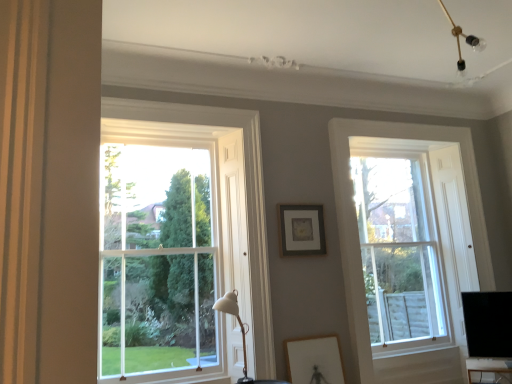
What is the approximate height of matte black picture frame at center, marked as the second picture frame in a front-to-back arrangement?

The height of matte black picture frame at center, marked as the second picture frame in a front-to-back arrangement, is 19.68 inches.

Locate an element on the screen. The width and height of the screenshot is (512, 384). clear glass window at right, the first window positioned from the back is located at coordinates (355, 217).

This screenshot has width=512, height=384. In order to click on clear glass window at left, which appears as the first window when viewed from the left in this screenshot , I will do `click(179, 241)`.

What is the approximate width of wooden framed picture at lower center, which is the 2th picture frame from top to bottom?

It is 2.80 inches.

At what (x,y) coordinates should I click in order to perform the action: click on white matte table lamp at center. Please return your answer as a coordinate pair (x, y). The width and height of the screenshot is (512, 384). Looking at the image, I should click on (239, 325).

This screenshot has height=384, width=512. What do you see at coordinates (488, 324) in the screenshot?
I see `black glossy monitor at lower right` at bounding box center [488, 324].

Find the location of a particular element. matte black picture frame at center, the first picture frame in the top-to-bottom sequence is located at coordinates (301, 230).

Is matte black picture frame at center, which is the second picture frame in bottom-to-top order, positioned beyond the bounds of clear glass window at right, the first window positioned from the back?

Yes, matte black picture frame at center, which is the second picture frame in bottom-to-top order, is not within clear glass window at right, the first window positioned from the back.

Is matte black picture frame at center, the first picture frame positioned from the back, positioned far away from clear glass window at right, which is the 2th window in front-to-back order?

matte black picture frame at center, the first picture frame positioned from the back, is actually quite close to clear glass window at right, which is the 2th window in front-to-back order.

How much distance is there between matte black picture frame at center, which is the second picture frame in bottom-to-top order, and clear glass window at right, which is the 2th window in front-to-back order?

25.44 inches.

Which object is positioned more to the right, matte black picture frame at center, which is the second picture frame in bottom-to-top order, or wooden framed picture at lower center, the 1th picture frame when ordered from front to back?

From the viewer's perspective, wooden framed picture at lower center, the 1th picture frame when ordered from front to back, appears more on the right side.

Looking at this image, from a real-world perspective, is matte black picture frame at center, the first picture frame positioned from the back, beneath wooden framed picture at lower center, arranged as the 1th picture frame when ordered from the bottom?

No, from a real-world perspective, matte black picture frame at center, the first picture frame positioned from the back, is not beneath wooden framed picture at lower center, arranged as the 1th picture frame when ordered from the bottom.

Can you confirm if matte black picture frame at center, marked as the second picture frame in a front-to-back arrangement, is wider than wooden framed picture at lower center, the 1th picture frame when ordered from front to back?

In fact, matte black picture frame at center, marked as the second picture frame in a front-to-back arrangement, might be narrower than wooden framed picture at lower center, the 1th picture frame when ordered from front to back.

Which of these two, matte black picture frame at center, the first picture frame positioned from the back, or wooden framed picture at lower center, which is the 2th picture frame from top to bottom, is smaller?

Smaller between the two is matte black picture frame at center, the first picture frame positioned from the back.

Where is `computer monitor that appears below the clear glass window at right, which is counted as the 2th window, starting from the left (from the image's perspective)`? The width and height of the screenshot is (512, 384). computer monitor that appears below the clear glass window at right, which is counted as the 2th window, starting from the left (from the image's perspective) is located at coordinates (488, 324).

Considering the sizes of objects clear glass window at right, which is counted as the 2th window, starting from the left, and black glossy monitor at lower right in the image provided, who is smaller, clear glass window at right, which is counted as the 2th window, starting from the left, or black glossy monitor at lower right?

With smaller size is black glossy monitor at lower right.

Measure the distance from clear glass window at right, the first window positioned from the back, to black glossy monitor at lower right.

A distance of 36.78 inches exists between clear glass window at right, the first window positioned from the back, and black glossy monitor at lower right.

Can you confirm if clear glass window at right, which is the 2th window in front-to-back order, is shorter than black glossy monitor at lower right?

No, clear glass window at right, which is the 2th window in front-to-back order, is not shorter than black glossy monitor at lower right.

Can you tell me how much clear glass window at left, positioned as the 2th window in back-to-front order, and black glossy monitor at lower right differ in facing direction?

There is a 43.9-degree angle between the facing directions of clear glass window at left, positioned as the 2th window in back-to-front order, and black glossy monitor at lower right.

In terms of width, does clear glass window at left, which appears as the first window when viewed from the left, look wider or thinner when compared to black glossy monitor at lower right?

In the image, clear glass window at left, which appears as the first window when viewed from the left, appears to be more narrow than black glossy monitor at lower right.

From a real-world perspective, is clear glass window at left, which appears as the first window when viewed from the left, above or below black glossy monitor at lower right?

clear glass window at left, which appears as the first window when viewed from the left, is above black glossy monitor at lower right.

Is clear glass window at left, positioned as the 2th window in back-to-front order, taller or shorter than black glossy monitor at lower right?

clear glass window at left, positioned as the 2th window in back-to-front order, is taller than black glossy monitor at lower right.

Considering the sizes of black glossy monitor at lower right and clear glass window at right, which is the 2th window in front-to-back order, in the image, is black glossy monitor at lower right taller or shorter than clear glass window at right, which is the 2th window in front-to-back order,?

Considering their sizes, black glossy monitor at lower right has less height than clear glass window at right, which is the 2th window in front-to-back order.

Is black glossy monitor at lower right oriented towards clear glass window at right, which is the 2th window in front-to-back order?

No, black glossy monitor at lower right is not turned towards clear glass window at right, which is the 2th window in front-to-back order.

Which is in front, black glossy monitor at lower right or clear glass window at right, the 1th window in the right-to-left sequence?

black glossy monitor at lower right is in front.

Can you confirm if black glossy monitor at lower right is smaller than clear glass window at right, which is counted as the 2th window, starting from the left?

Yes.

From the image's perspective, relative to black glossy monitor at lower right, is wooden framed picture at lower center, arranged as the 1th picture frame when ordered from the bottom, above or below?

Based on their image positions, wooden framed picture at lower center, arranged as the 1th picture frame when ordered from the bottom, is located beneath black glossy monitor at lower right.

Looking at this image, between wooden framed picture at lower center, arranged as the 1th picture frame when ordered from the bottom, and black glossy monitor at lower right, which one has larger size?

With larger size is black glossy monitor at lower right.

From a real-world perspective, which is physically above, wooden framed picture at lower center, the 1th picture frame when ordered from front to back, or black glossy monitor at lower right?

In real-world perspective, black glossy monitor at lower right is above.

Between clear glass window at left, positioned as the 2th window in back-to-front order, and wooden framed picture at lower center, the 1th picture frame when ordered from front to back, which one has smaller size?

wooden framed picture at lower center, the 1th picture frame when ordered from front to back, is smaller.

Can you confirm if clear glass window at left, which is the first window in front-to-back order, is taller than wooden framed picture at lower center, the 1th picture frame when ordered from front to back?

Indeed, clear glass window at left, which is the first window in front-to-back order, has a greater height compared to wooden framed picture at lower center, the 1th picture frame when ordered from front to back.

Is clear glass window at left, which appears as the 2th window when viewed from the right, positioned with its back to wooden framed picture at lower center, the 2th picture frame when ordered from back to front?

That's not correct — clear glass window at left, which appears as the 2th window when viewed from the right, is not looking away from wooden framed picture at lower center, the 2th picture frame when ordered from back to front.

Visually, is clear glass window at left, which appears as the first window when viewed from the left, positioned to the left or to the right of wooden framed picture at lower center, the 2th picture frame when ordered from back to front?

Clearly, clear glass window at left, which appears as the first window when viewed from the left, is on the left of wooden framed picture at lower center, the 2th picture frame when ordered from back to front, in the image.

Find the location of a particular element. The image size is (512, 384). picture frame that is above the clear glass window at right, the first window positioned from the back (from the image's perspective) is located at coordinates (301, 230).

At what (x,y) coordinates should I click in order to perform the action: click on picture frame lying behind the wooden framed picture at lower center, arranged as the 1th picture frame when ordered from the bottom. Please return your answer as a coordinate pair (x, y). Looking at the image, I should click on (301, 230).

Considering their positions, is white matte table lamp at center positioned further to clear glass window at left, which appears as the first window when viewed from the left, than black glossy monitor at lower right?

The object further to clear glass window at left, which appears as the first window when viewed from the left, is black glossy monitor at lower right.

Looking at the image, which one is located closer to black glossy monitor at lower right, clear glass window at right, which is the 2th window in front-to-back order, or matte black picture frame at center, the first picture frame positioned from the back?

clear glass window at right, which is the 2th window in front-to-back order, lies closer to black glossy monitor at lower right than the other object.

Considering their positions, is black glossy monitor at lower right positioned further to clear glass window at right, which is counted as the 2th window, starting from the left, than wooden framed picture at lower center, the 1th picture frame when ordered from front to back?

Based on the image, black glossy monitor at lower right appears to be further to clear glass window at right, which is counted as the 2th window, starting from the left.

Which object lies further to the anchor point matte black picture frame at center, the first picture frame positioned from the back, clear glass window at right, which is counted as the 2th window, starting from the left, or black glossy monitor at lower right?

black glossy monitor at lower right is positioned further to the anchor matte black picture frame at center, the first picture frame positioned from the back.

From the image, which object appears to be nearer to wooden framed picture at lower center, which is the 2th picture frame from top to bottom, white matte table lamp at center or clear glass window at left, which is the first window in front-to-back order?

white matte table lamp at center is closer to wooden framed picture at lower center, which is the 2th picture frame from top to bottom.

Estimate the real-world distances between objects in this image. Which object is closer to wooden framed picture at lower center, arranged as the 1th picture frame when ordered from the bottom, clear glass window at right, the 1th window in the right-to-left sequence, or black glossy monitor at lower right?

Among the two, clear glass window at right, the 1th window in the right-to-left sequence, is located nearer to wooden framed picture at lower center, arranged as the 1th picture frame when ordered from the bottom.

Considering their positions, is wooden framed picture at lower center, arranged as the 1th picture frame when ordered from the bottom, positioned closer to matte black picture frame at center, which is the second picture frame in bottom-to-top order, than clear glass window at left, which appears as the 2th window when viewed from the right?

clear glass window at left, which appears as the 2th window when viewed from the right.

Considering their positions, is clear glass window at right, the first window positioned from the back, positioned closer to black glossy monitor at lower right than wooden framed picture at lower center, arranged as the 1th picture frame when ordered from the bottom?

Based on the image, clear glass window at right, the first window positioned from the back, appears to be nearer to black glossy monitor at lower right.

This screenshot has height=384, width=512. Find the location of `window situated between clear glass window at left, which is the first window in front-to-back order, and black glossy monitor at lower right from left to right`. window situated between clear glass window at left, which is the first window in front-to-back order, and black glossy monitor at lower right from left to right is located at coordinates (355, 217).

Locate an element on the screen. This screenshot has width=512, height=384. picture frame between matte black picture frame at center, the first picture frame positioned from the back, and black glossy monitor at lower right is located at coordinates (314, 360).

The image size is (512, 384). Identify the location of window between white matte table lamp at center and black glossy monitor at lower right in the horizontal direction. (355, 217).

You are a GUI agent. You are given a task and a screenshot of the screen. Output one action in this format:
    pyautogui.click(x=<x>, y=<y>)
    Task: Click on the table lamp between matte black picture frame at center, the first picture frame positioned from the back, and wooden framed picture at lower center, which is the 2th picture frame from top to bottom, from top to bottom
    
    Given the screenshot: What is the action you would take?
    pyautogui.click(x=239, y=325)